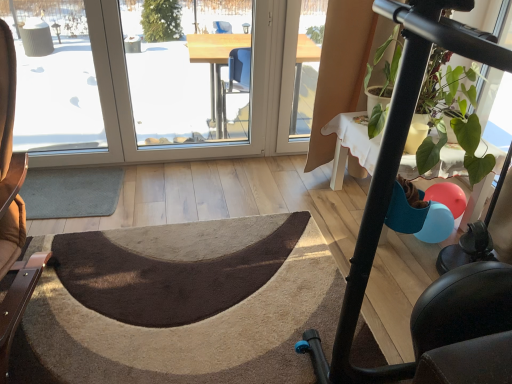
The image size is (512, 384). I want to click on vacant area on top of gray carpet at lower left, the second doormat ordered from the bottom (from a real-world perspective), so (76, 186).